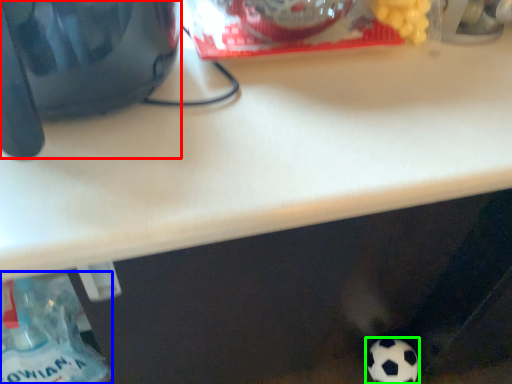
Question: Which object is positioned farthest from appliance (highlighted by a red box)? Select from bottle (highlighted by a blue box) and football (highlighted by a green box).

Choices:
 (A) bottle
 (B) football

Answer: (B)